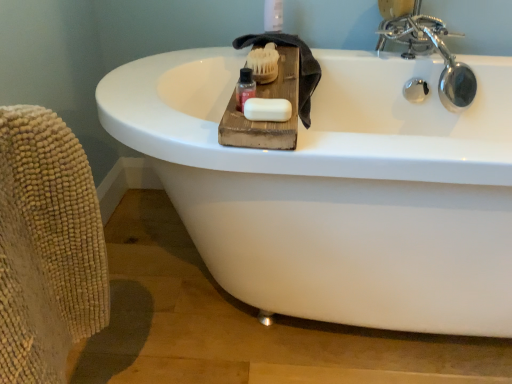
Question: From the image's perspective, would you say chrome metallic faucet at upper right is positioned over beige textured armchair at left?

Choices:
 (A) no
 (B) yes

Answer: (B)

Question: Does chrome metallic faucet at upper right have a greater height compared to beige textured armchair at left?

Choices:
 (A) yes
 (B) no

Answer: (B)

Question: Is chrome metallic faucet at upper right far from beige textured armchair at left?

Choices:
 (A) yes
 (B) no

Answer: (A)

Question: Does chrome metallic faucet at upper right have a lesser width compared to beige textured armchair at left?

Choices:
 (A) no
 (B) yes

Answer: (A)

Question: Is chrome metallic faucet at upper right facing towards beige textured armchair at left?

Choices:
 (A) yes
 (B) no

Answer: (B)

Question: From a real-world perspective, is chrome metallic faucet at upper right on top of beige textured armchair at left?

Choices:
 (A) yes
 (B) no

Answer: (A)

Question: Does chrome metallic faucet at upper right have a smaller size compared to dark gray textured towel at upper center?

Choices:
 (A) no
 (B) yes

Answer: (A)

Question: Considering the relative sizes of chrome metallic faucet at upper right and dark gray textured towel at upper center in the image provided, is chrome metallic faucet at upper right shorter than dark gray textured towel at upper center?

Choices:
 (A) yes
 (B) no

Answer: (B)

Question: Is chrome metallic faucet at upper right located outside dark gray textured towel at upper center?

Choices:
 (A) no
 (B) yes

Answer: (B)

Question: From a real-world perspective, is chrome metallic faucet at upper right on top of dark gray textured towel at upper center?

Choices:
 (A) yes
 (B) no

Answer: (A)

Question: Are chrome metallic faucet at upper right and dark gray textured towel at upper center located far from each other?

Choices:
 (A) no
 (B) yes

Answer: (A)

Question: Is chrome metallic faucet at upper right beside dark gray textured towel at upper center?

Choices:
 (A) yes
 (B) no

Answer: (B)

Question: Would you say translucent plastic bottle at upper center is part of beige textured armchair at left's contents?

Choices:
 (A) no
 (B) yes

Answer: (A)